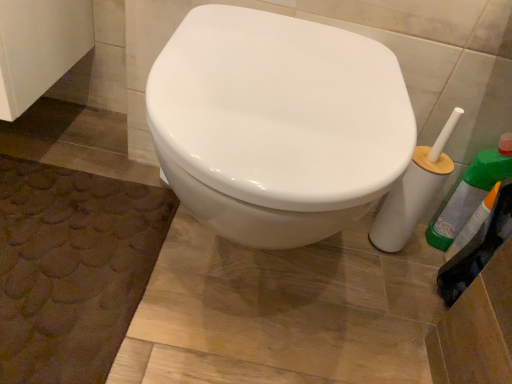
Question: Considering the relative sizes of brown textured bath mat at lower left and green plastic bottle at right in the image provided, is brown textured bath mat at lower left shorter than green plastic bottle at right?

Choices:
 (A) no
 (B) yes

Answer: (B)

Question: Is brown textured bath mat at lower left bigger than green plastic bottle at right?

Choices:
 (A) no
 (B) yes

Answer: (B)

Question: From the image's perspective, does brown textured bath mat at lower left appear higher than green plastic bottle at right?

Choices:
 (A) yes
 (B) no

Answer: (B)

Question: Can you confirm if brown textured bath mat at lower left is thinner than green plastic bottle at right?

Choices:
 (A) no
 (B) yes

Answer: (A)

Question: Is brown textured bath mat at lower left beside green plastic bottle at right?

Choices:
 (A) yes
 (B) no

Answer: (B)

Question: Is green plastic bottle at right located within brown textured bath mat at lower left?

Choices:
 (A) no
 (B) yes

Answer: (A)

Question: From the image's perspective, is green plastic bottle at right on top of brown textured bath mat at lower left?

Choices:
 (A) no
 (B) yes

Answer: (B)

Question: From a real-world perspective, is green plastic bottle at right over brown textured bath mat at lower left?

Choices:
 (A) no
 (B) yes

Answer: (B)

Question: Considering the relative positions of green plastic bottle at right and brown textured bath mat at lower left in the image provided, is green plastic bottle at right to the left of brown textured bath mat at lower left from the viewer's perspective?

Choices:
 (A) yes
 (B) no

Answer: (B)

Question: Does green plastic bottle at right have a greater width compared to brown textured bath mat at lower left?

Choices:
 (A) no
 (B) yes

Answer: (A)

Question: Is green plastic bottle at right outside brown textured bath mat at lower left?

Choices:
 (A) yes
 (B) no

Answer: (A)

Question: From the image's perspective, does green plastic bottle at right appear lower than brown textured bath mat at lower left?

Choices:
 (A) yes
 (B) no

Answer: (B)

Question: From the image's perspective, relative to brown textured bath mat at lower left, is green plastic bottle at right above or below?

Choices:
 (A) below
 (B) above

Answer: (B)